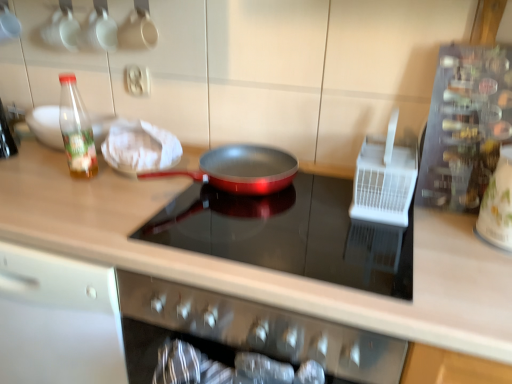
Question: Can you confirm if white plastic utensil holder at right, which ranks as the third appliance in right-to-left order, is positioned to the right of white glossy jar at right, the 3th appliance positioned from the left?

Choices:
 (A) yes
 (B) no

Answer: (B)

Question: Is white plastic utensil holder at right, which is the 1th appliance from left to right, smaller than white glossy jar at right, the 3th appliance positioned from the left?

Choices:
 (A) no
 (B) yes

Answer: (A)

Question: Can you confirm if white plastic utensil holder at right, which ranks as the third appliance in right-to-left order, is positioned to the left of white glossy jar at right, arranged as the first appliance when viewed from the right?

Choices:
 (A) no
 (B) yes

Answer: (B)

Question: Can we say white plastic utensil holder at right, which is the 1th appliance from left to right, lies outside white glossy jar at right, arranged as the first appliance when viewed from the right?

Choices:
 (A) yes
 (B) no

Answer: (A)

Question: Can you see white plastic utensil holder at right, which is the 1th appliance from left to right, touching white glossy jar at right, the 3th appliance positioned from the left?

Choices:
 (A) no
 (B) yes

Answer: (A)

Question: From a real-world perspective, is metallic red frying pan at center physically located above or below transparent plastic bottle at left?

Choices:
 (A) above
 (B) below

Answer: (B)

Question: Is point (202, 236) closer or farther from the camera than point (68, 150)?

Choices:
 (A) closer
 (B) farther

Answer: (A)

Question: Is metallic red frying pan at center situated inside transparent plastic bottle at left or outside?

Choices:
 (A) inside
 (B) outside

Answer: (B)

Question: Is metallic red frying pan at center taller or shorter than transparent plastic bottle at left?

Choices:
 (A) short
 (B) tall

Answer: (A)

Question: Is transparent plastic bottle at left situated inside metallic red frying pan at center or outside?

Choices:
 (A) inside
 (B) outside

Answer: (B)

Question: Is transparent plastic bottle at left bigger or smaller than metallic red frying pan at center?

Choices:
 (A) big
 (B) small

Answer: (B)

Question: Looking at their shapes, would you say transparent plastic bottle at left is wider or thinner than metallic red frying pan at center?

Choices:
 (A) thin
 (B) wide

Answer: (A)

Question: Relative to metallic red frying pan at center, is transparent plastic bottle at left in front or behind?

Choices:
 (A) front
 (B) behind

Answer: (B)

Question: Is white plastic utensil holder at right, which is the 1th appliance from left to right, taller or shorter than metallic silver spice rack at right, placed as the second appliance when sorted from left to right?

Choices:
 (A) short
 (B) tall

Answer: (A)

Question: Is white plastic utensil holder at right, which is the 1th appliance from left to right, bigger or smaller than metallic silver spice rack at right, placed as the second appliance when sorted from left to right?

Choices:
 (A) small
 (B) big

Answer: (A)